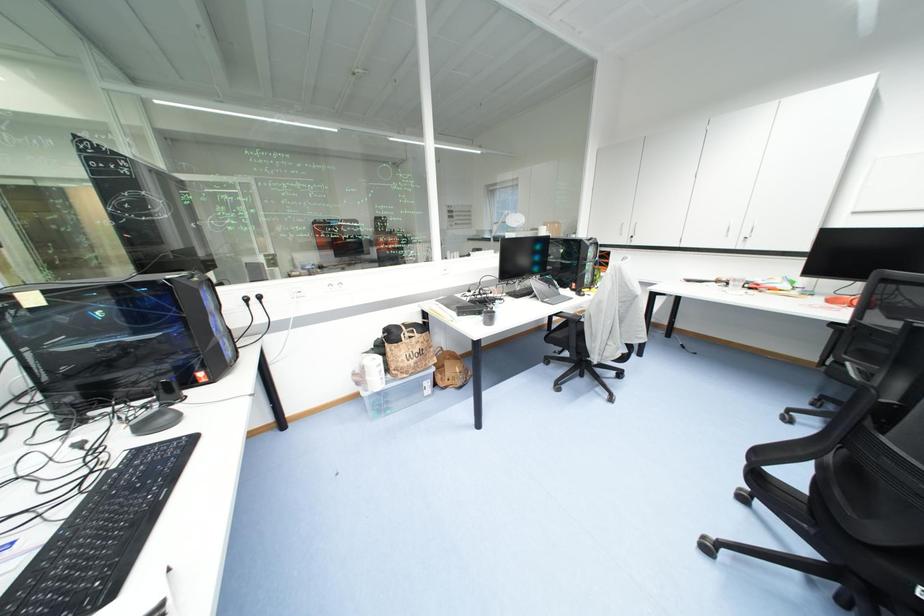
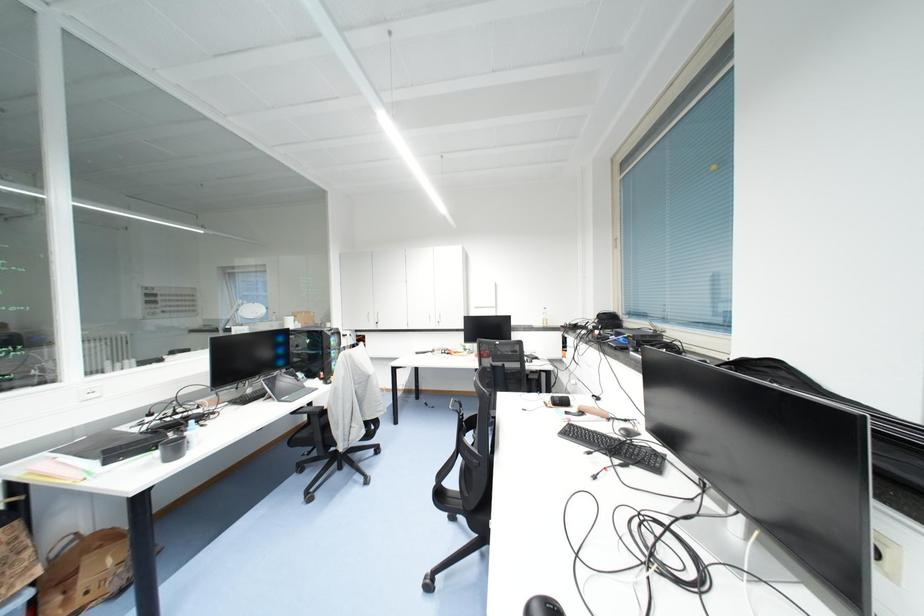
Question: The camera is either moving clockwise (left) or counter-clockwise (right) around the object. The first image is from the beginning of the video and the second image is from the end. Is the camera moving left or right when shooting the video?

Choices:
 (A) Left
 (B) Right

Answer: (A)